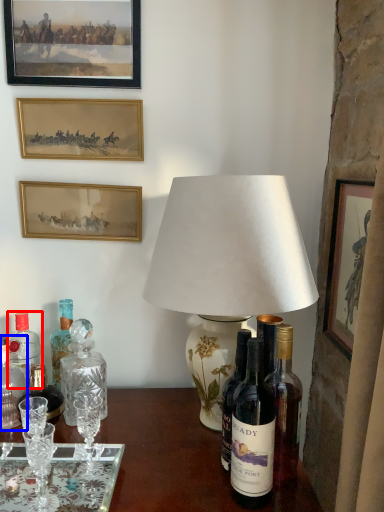
Question: Which object is closer to the camera taking this photo, bottle (highlighted by a red box) or bottle (highlighted by a blue box)?

Choices:
 (A) bottle
 (B) bottle

Answer: (B)